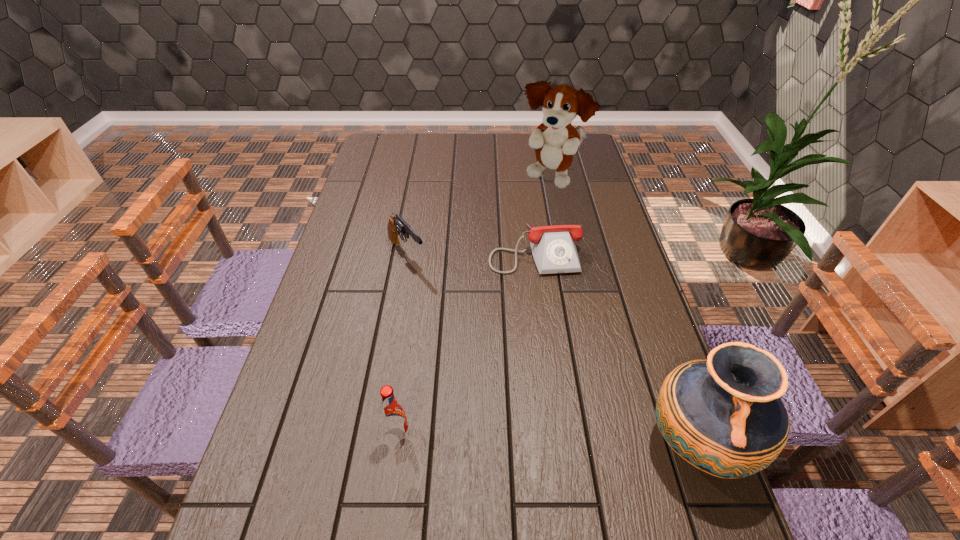
You are a GUI agent. You are given a task and a screenshot of the screen. Output one action in this format:
    pyautogui.click(x=<x>, y=<y>)
    Task: Click on the telephone present at the right edge
    The width and height of the screenshot is (960, 540).
    Given the screenshot: What is the action you would take?
    pyautogui.click(x=554, y=251)

This screenshot has width=960, height=540. In order to click on puppy positioned at the right edge in this screenshot , I will do (556, 141).

The image size is (960, 540). In order to click on object present at the near right corner in this screenshot , I will do `click(724, 416)`.

At what (x,y) coordinates should I click in order to perform the action: click on vacant region at the far edge. Please return your answer as a coordinate pair (x, y). The height and width of the screenshot is (540, 960). Looking at the image, I should click on pyautogui.click(x=421, y=157).

Locate an element on the screen. Image resolution: width=960 pixels, height=540 pixels. blank area at the near edge is located at coordinates (563, 495).

The height and width of the screenshot is (540, 960). In the image, there is a desktop. What are the coordinates of `blank space at the left edge` in the screenshot? It's located at (383, 187).

In order to click on blank space at the right edge of the desktop in this screenshot , I will do `click(622, 276)`.

Find the location of a particular element. The image size is (960, 540). vacant space at the far left corner of the desktop is located at coordinates (406, 143).

Where is `vacant space at the near right corner`? This screenshot has width=960, height=540. vacant space at the near right corner is located at coordinates coord(634,491).

At what (x,y) coordinates should I click in order to perform the action: click on vacant area that lies between the puppy and the telephone. Please return your answer as a coordinate pair (x, y). This screenshot has height=540, width=960. Looking at the image, I should click on (542, 215).